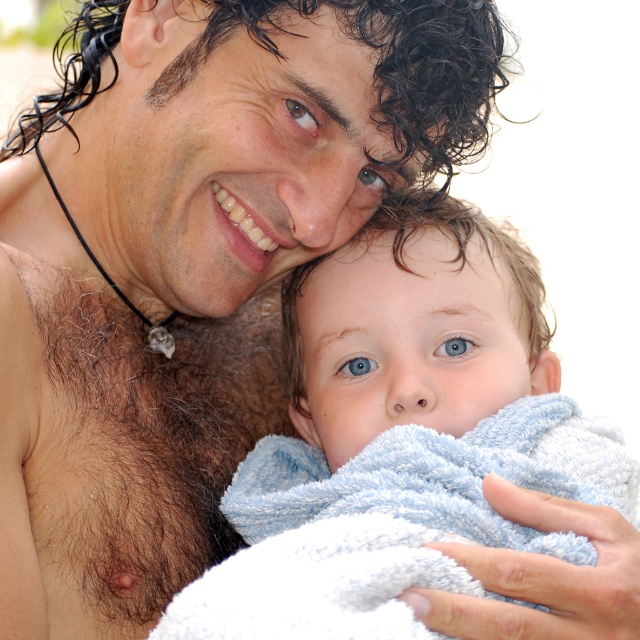
Question: Among these objects, which one is farthest from the camera?

Choices:
 (A) hairy skin at left
 (B) blue soft towel at center

Answer: (A)

Question: Can you confirm if blue soft towel at center is positioned to the left of hairy skin at left?

Choices:
 (A) no
 (B) yes

Answer: (A)

Question: Is blue soft towel at center wider than hairy skin at left?

Choices:
 (A) yes
 (B) no

Answer: (A)

Question: Is blue soft towel at center wider than hairy skin at left?

Choices:
 (A) yes
 (B) no

Answer: (A)